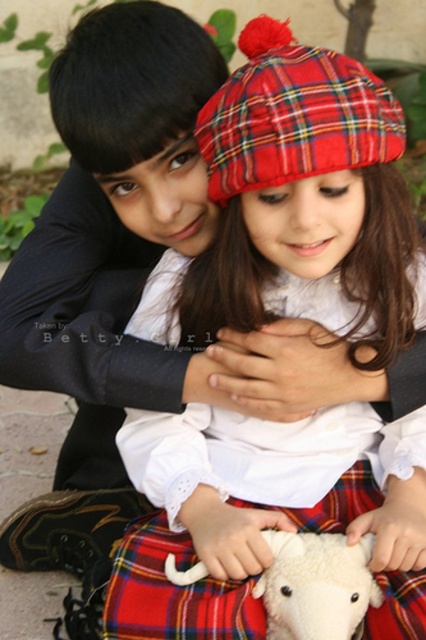
You are a photographer trying to capture the two subjects in the image. The red plaid kilt at lower center and the white soft lamb at center are both in your viewfinder. Since you want to focus on the smaller subject, which one should you adjust your camera settings for?

The white soft lamb at center is smaller than the red plaid kilt at lower center, so you should adjust your camera settings to focus on the white soft lamb at center.